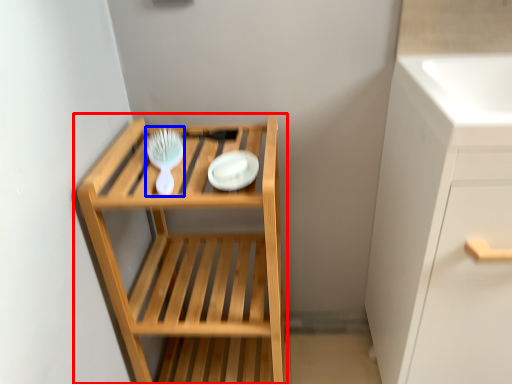
Question: Among these objects, which one is farthest to the camera, shelf (highlighted by a red box) or brush (highlighted by a blue box)?

Choices:
 (A) shelf
 (B) brush

Answer: (B)